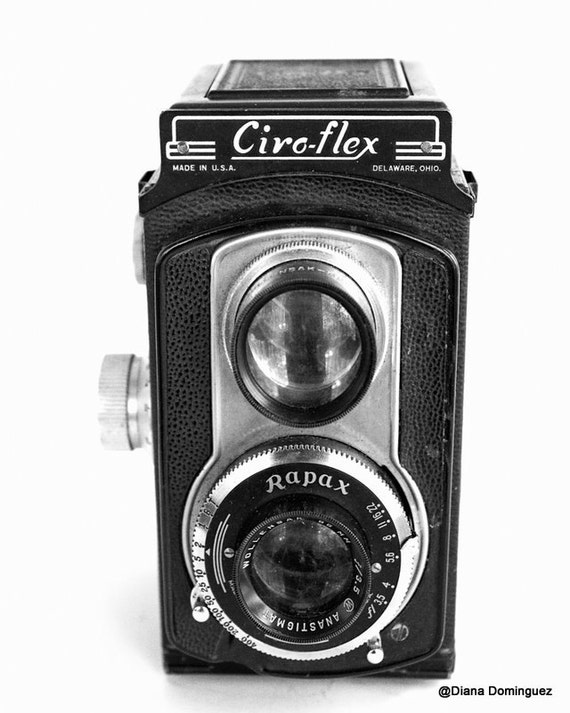
You are a GUI agent. You are given a task and a screenshot of the screen. Output one action in this format:
    pyautogui.click(x=<x>, y=<y>)
    Task: Click on the shadow under the device
    Image resolution: width=570 pixels, height=713 pixels.
    Given the screenshot: What is the action you would take?
    pyautogui.click(x=280, y=687)